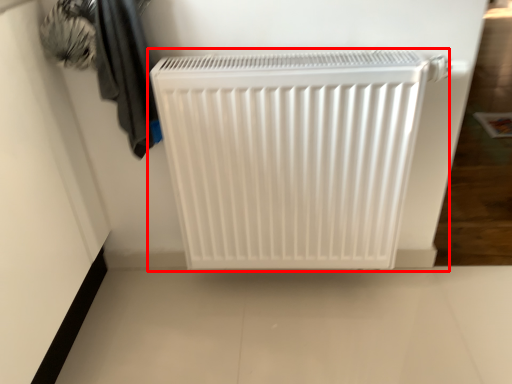
Question: From the image, what is the correct spatial relationship of home appliance (annotated by the red box) in relation to laundry?

Choices:
 (A) right
 (B) left

Answer: (A)